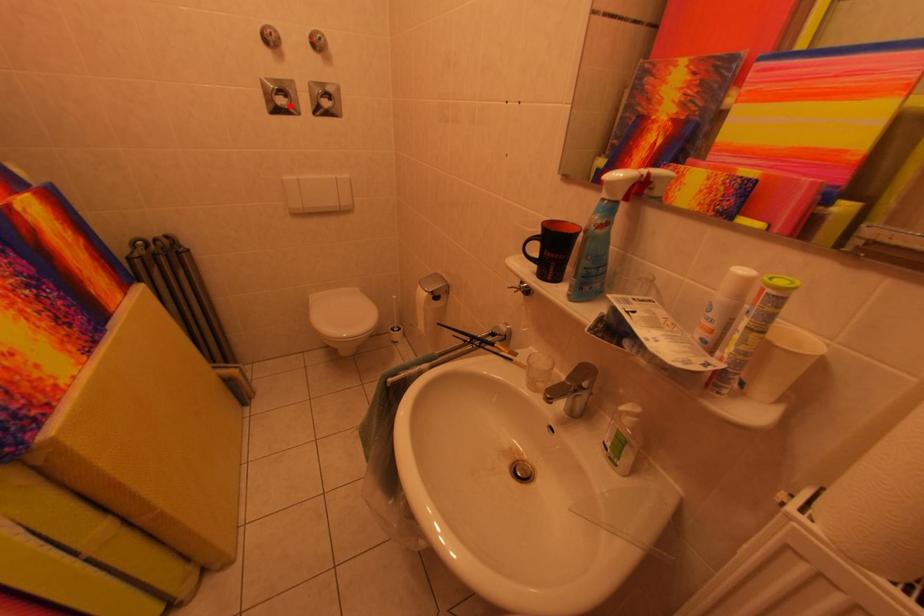
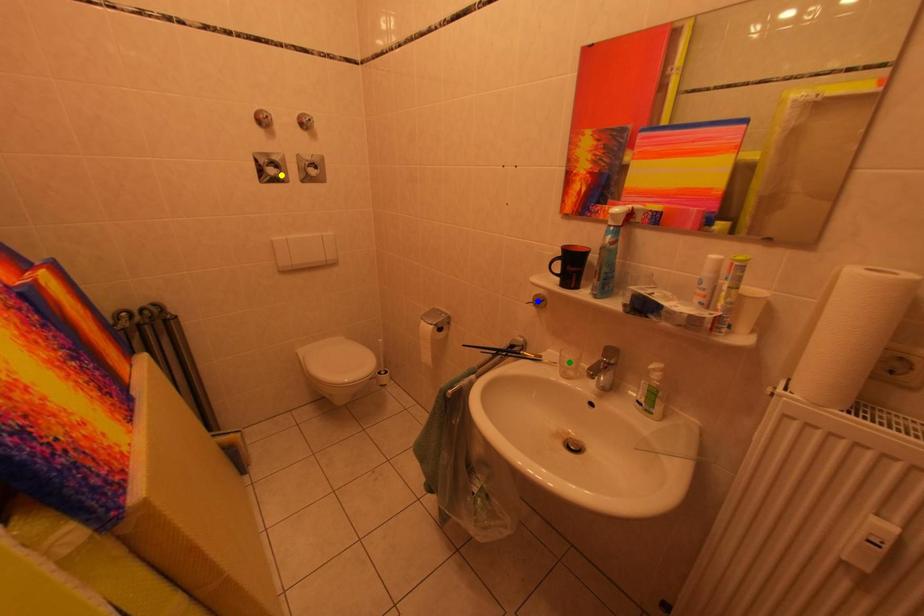
Question: I am providing you with two images of the same scene from different viewpoints. A red point is marked on the first image. You are given multiple points on the second image. In image 2, which mark is for the same physical point as the one in image 1?

Choices:
 (A) blue point
 (B) yellow point
 (C) green point

Answer: (B)